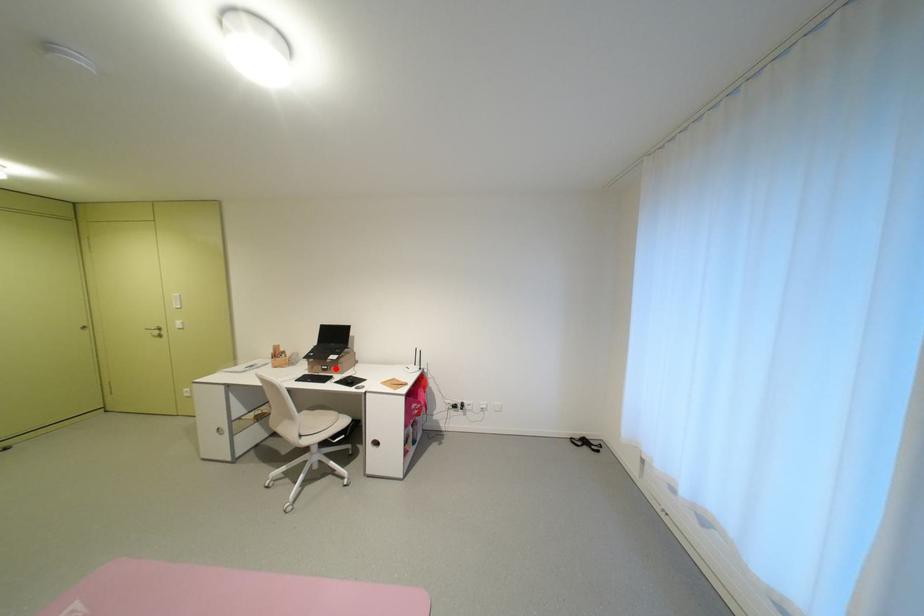
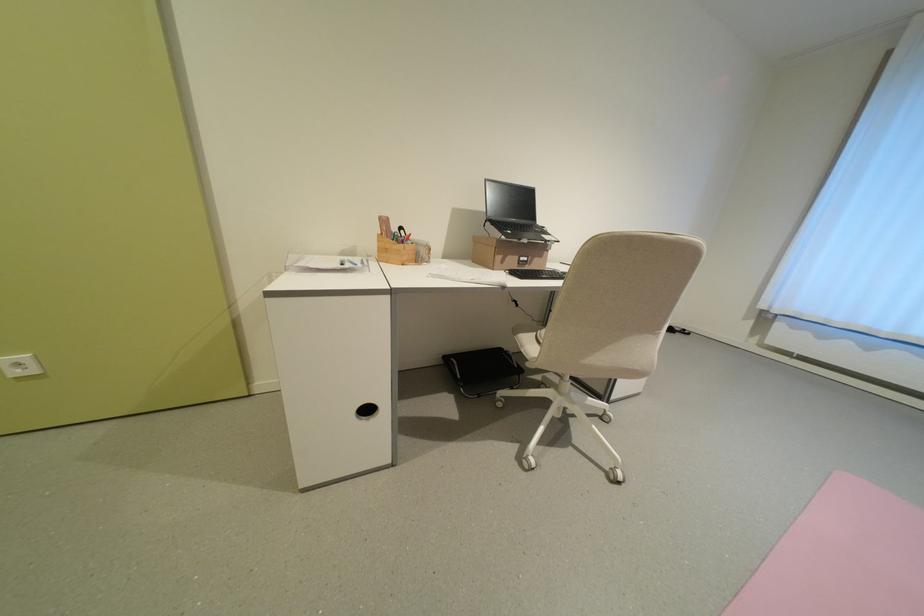
In the second image, find the point that corresponds to the highlighted location in the first image.

(536, 261)